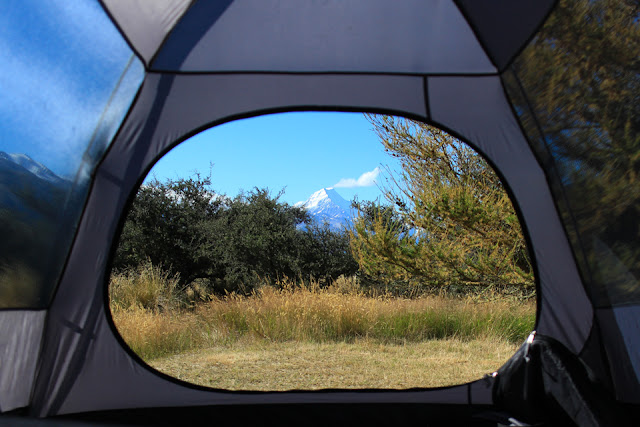
Locate an element on the screen. This screenshot has width=640, height=427. flap of window is located at coordinates (554, 380).